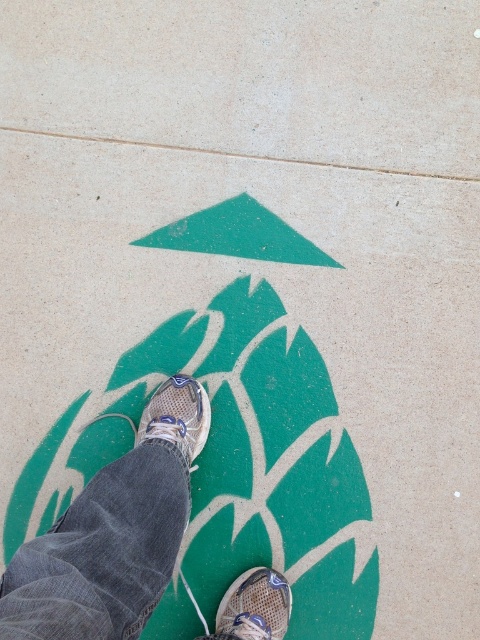
Question: Which object is positioned closest to the green matte triangle at center?

Choices:
 (A) textured beige sneakers at center
 (B) mesh athletic shoe at center

Answer: (A)

Question: Which object is positioned closest to the mesh athletic shoe at center?

Choices:
 (A) green matte triangle at center
 (B) textured beige sneakers at center

Answer: (B)

Question: In this image, where is mesh athletic shoe at center located relative to matte gray running shoe at center?

Choices:
 (A) right
 (B) left

Answer: (A)

Question: Where is textured beige sneakers at center located in relation to green matte triangle at center in the image?

Choices:
 (A) right
 (B) left

Answer: (B)

Question: Does green matte triangle at center lie in front of matte gray running shoe at center?

Choices:
 (A) no
 (B) yes

Answer: (A)

Question: Considering the real-world distances, which object is closest to the mesh athletic shoe at center?

Choices:
 (A) green matte triangle at center
 (B) textured beige sneakers at center
 (C) matte gray running shoe at center

Answer: (B)